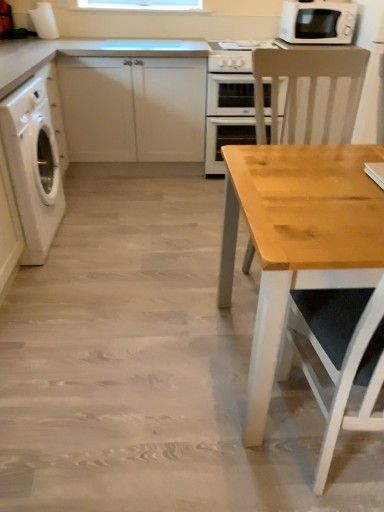
Question: From the image's perspective, is white glossy washing machine at left located beneath beige plastic microwave at upper right?

Choices:
 (A) no
 (B) yes

Answer: (B)

Question: Does white glossy washing machine at left come behind beige plastic microwave at upper right?

Choices:
 (A) no
 (B) yes

Answer: (A)

Question: Can you confirm if white glossy washing machine at left is wider than beige plastic microwave at upper right?

Choices:
 (A) no
 (B) yes

Answer: (B)

Question: Is white glossy washing machine at left positioned in front of beige plastic microwave at upper right?

Choices:
 (A) yes
 (B) no

Answer: (A)

Question: Does white glossy washing machine at left touch beige plastic microwave at upper right?

Choices:
 (A) yes
 (B) no

Answer: (B)

Question: Relative to white glossy oven at center, is light wood chair at right in front or behind?

Choices:
 (A) behind
 (B) front

Answer: (B)

Question: Would you say light wood chair at right is to the left or to the right of white glossy oven at center in the picture?

Choices:
 (A) right
 (B) left

Answer: (A)

Question: Is light wood chair at right bigger or smaller than white glossy oven at center?

Choices:
 (A) big
 (B) small

Answer: (A)

Question: In terms of height, does light wood chair at right look taller or shorter compared to white glossy oven at center?

Choices:
 (A) short
 (B) tall

Answer: (B)

Question: From a real-world perspective, relative to white glossy oven at center, is white matte cabinet at left vertically above or below?

Choices:
 (A) above
 (B) below

Answer: (A)

Question: Do you think white matte cabinet at left is within white glossy oven at center, or outside of it?

Choices:
 (A) inside
 (B) outside

Answer: (B)

Question: From the image's perspective, is white matte cabinet at left positioned above or below white glossy oven at center?

Choices:
 (A) above
 (B) below

Answer: (A)

Question: Does point (61, 87) appear closer or farther from the camera than point (221, 125)?

Choices:
 (A) closer
 (B) farther

Answer: (A)

Question: Considering the positions of beige plastic microwave at upper right and white glossy oven at center in the image, is beige plastic microwave at upper right wider or thinner than white glossy oven at center?

Choices:
 (A) wide
 (B) thin

Answer: (B)

Question: From the image's perspective, relative to white glossy oven at center, is beige plastic microwave at upper right above or below?

Choices:
 (A) below
 (B) above

Answer: (B)